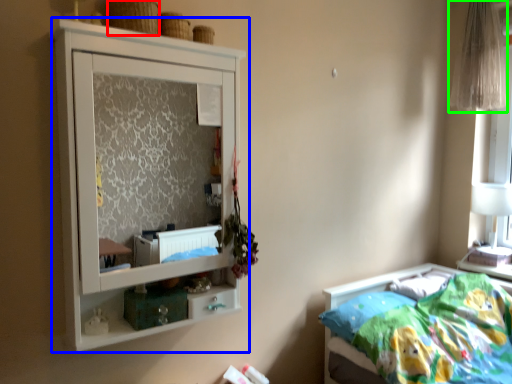
Question: Which object is positioned closest to basket (highlighted by a red box)? Select from cupboard (highlighted by a blue box) and curtain (highlighted by a green box).

Choices:
 (A) cupboard
 (B) curtain

Answer: (B)